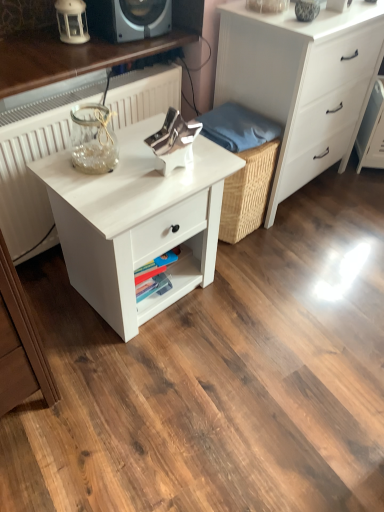
Where is `free space in front of white matte nightstand at center`? free space in front of white matte nightstand at center is located at coordinates (139, 380).